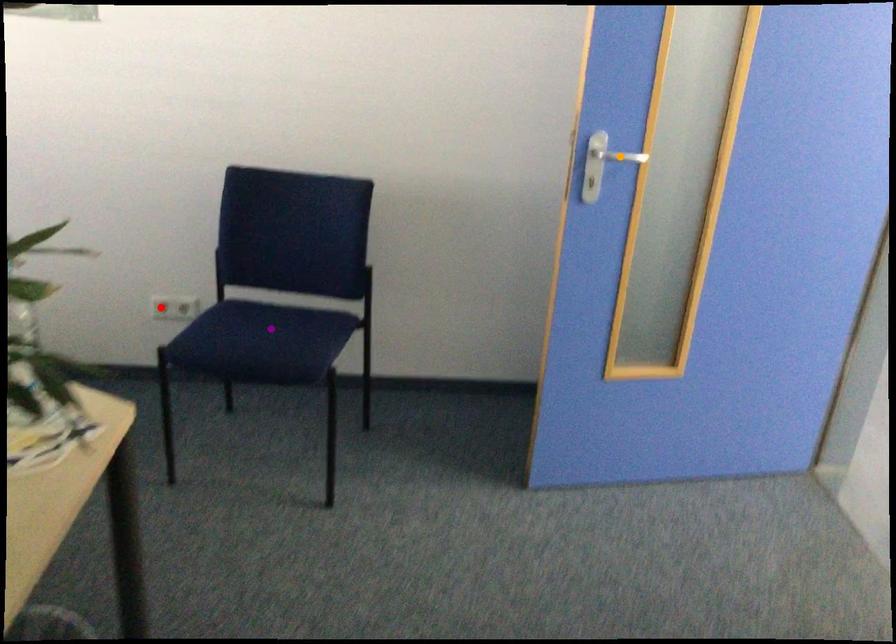
Order these from nearest to farthest:
red point, purple point, orange point

orange point
purple point
red point